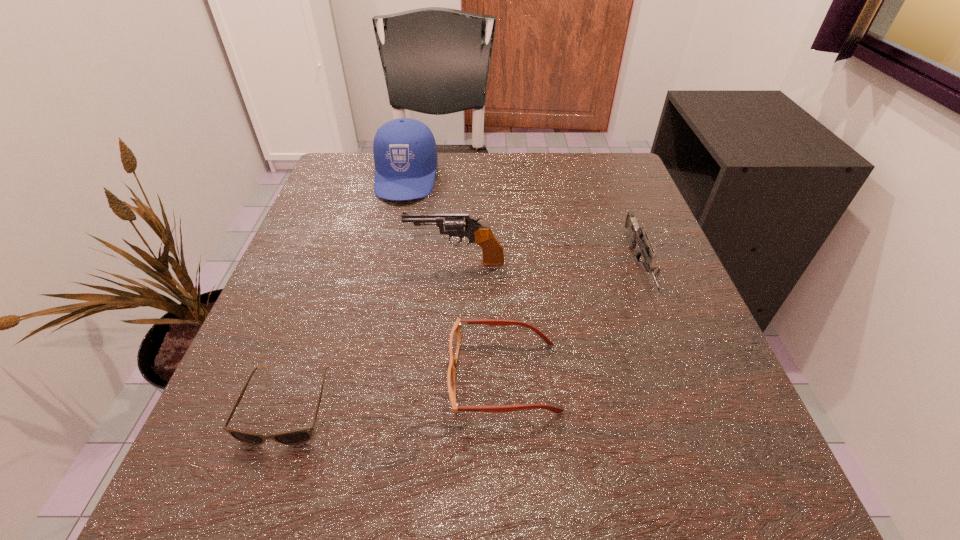
This screenshot has width=960, height=540. I want to click on cap, so click(x=405, y=153).

The image size is (960, 540). In order to click on the taller gun in this screenshot , I will do `click(482, 235)`.

This screenshot has height=540, width=960. What are the coordinates of `the right gun` in the screenshot? It's located at (636, 232).

Find the location of a particular element. This screenshot has height=540, width=960. the shorter gun is located at coordinates (636, 232).

At what (x,y) coordinates should I click in order to perform the action: click on spectacles. Please return your answer as a coordinate pair (x, y). This screenshot has height=540, width=960. Looking at the image, I should click on (455, 337).

This screenshot has width=960, height=540. In order to click on the shortest object in this screenshot , I will do `click(295, 437)`.

I want to click on free space located on the front-facing side of the cap, so click(389, 253).

Where is `vacant area located 0.130m along the barrel of the left gun`? Image resolution: width=960 pixels, height=540 pixels. vacant area located 0.130m along the barrel of the left gun is located at coordinates 339,261.

Image resolution: width=960 pixels, height=540 pixels. In order to click on vacant space located along the barrel of the left gun in this screenshot , I will do `click(345, 261)`.

You are a GUI agent. You are given a task and a screenshot of the screen. Output one action in this format:
    pyautogui.click(x=<x>, y=<y>)
    Task: Click on the vacant space located 0.110m along the barrel of the left gun
    Image resolution: width=960 pixels, height=540 pixels.
    Given the screenshot: What is the action you would take?
    pyautogui.click(x=350, y=261)